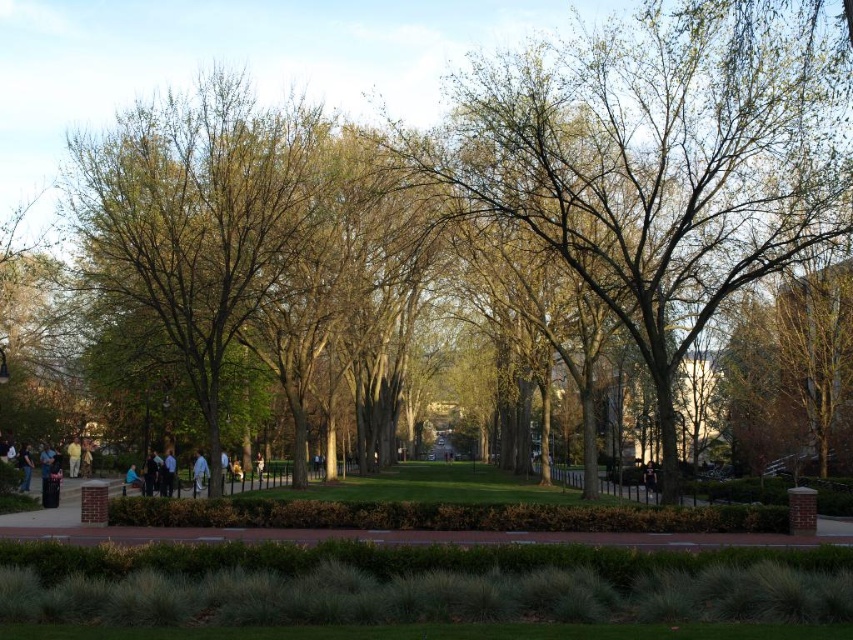
Question: Is brown brick path at center positioned before light blue fabric at center?

Choices:
 (A) yes
 (B) no

Answer: (A)

Question: Does brown brick path at center appear on the right side of light blue fabric at center?

Choices:
 (A) no
 (B) yes

Answer: (B)

Question: Which of the following is the farthest from the observer?

Choices:
 (A) (674, 540)
 (B) (207, 467)

Answer: (B)

Question: Can you confirm if brown brick path at center is smaller than light blue fabric at center?

Choices:
 (A) yes
 (B) no

Answer: (B)